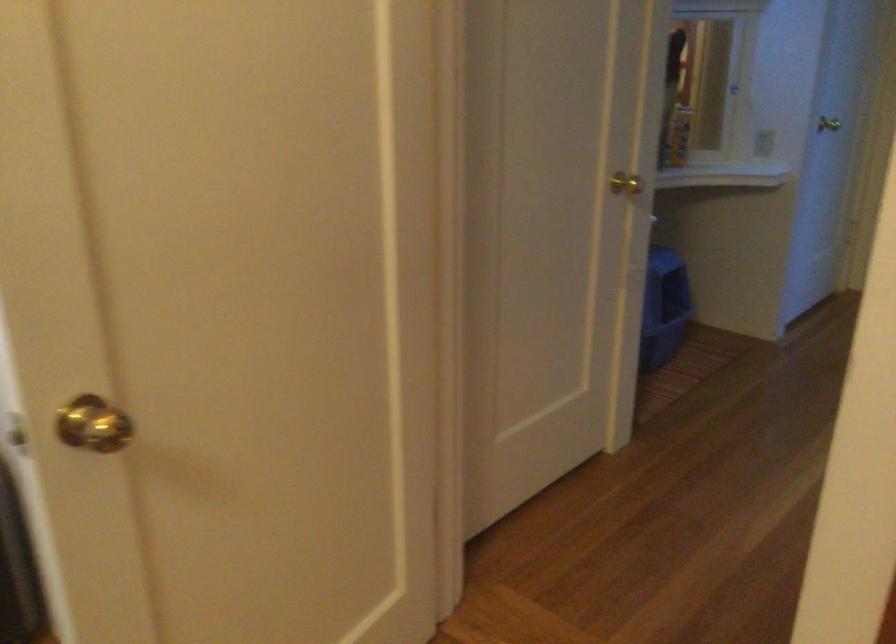
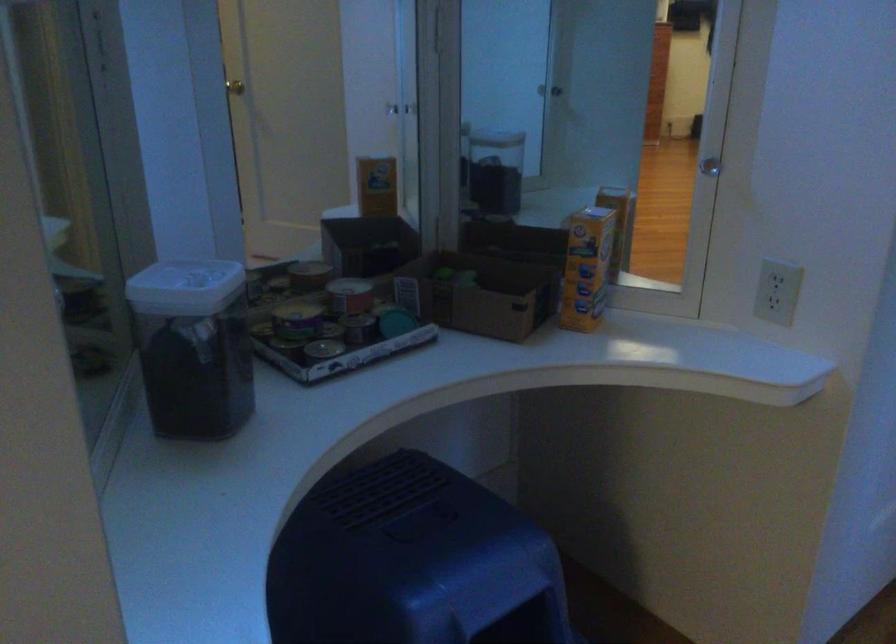
In a continuous first-person perspective shot, in which direction is the camera moving?

The cameraman walked toward right, forward.